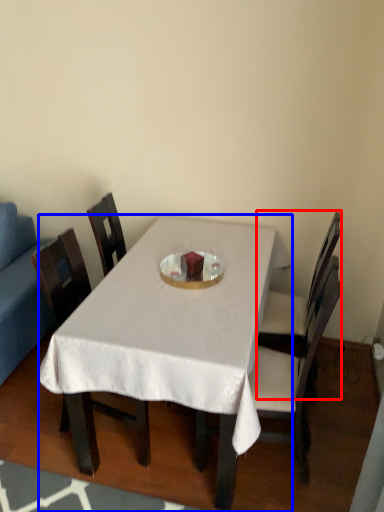
Question: Which object appears closest to the camera in this image, chair (highlighted by a red box) or desk (highlighted by a blue box)?

Choices:
 (A) chair
 (B) desk

Answer: (B)